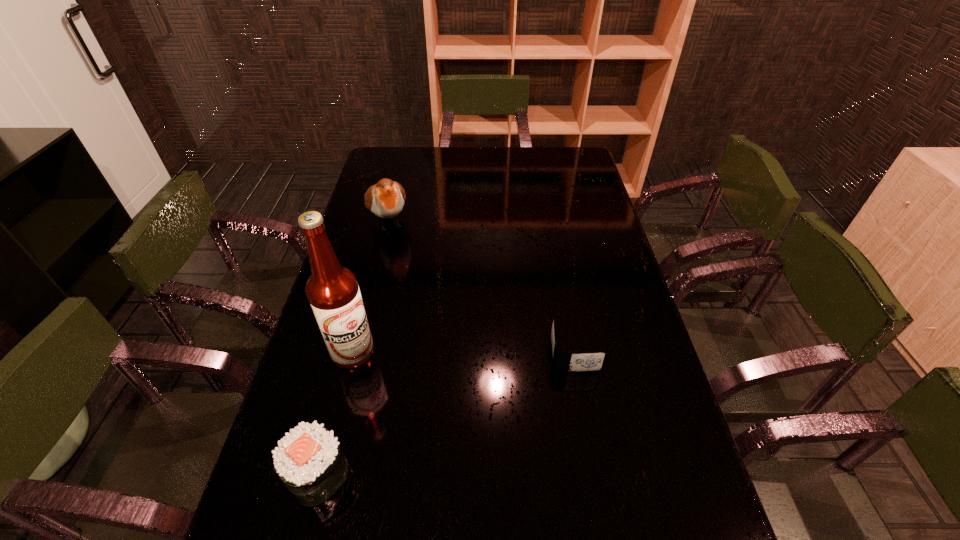
Find the location of a particular element. The width and height of the screenshot is (960, 540). free location located on the label side of the tallest object is located at coordinates (496, 420).

Locate an element on the screen. free space located 0.190m on the label side of the tallest object is located at coordinates (431, 389).

You are a GUI agent. You are given a task and a screenshot of the screen. Output one action in this format:
    pyautogui.click(x=<x>, y=<y>)
    Task: Click on the vacant space located 0.390m at the face of the second tallest object
    
    Given the screenshot: What is the action you would take?
    (427, 321)

Identify the location of vacant space located at the face of the second tallest object. (408, 276).

At what (x,y) coordinates should I click in order to perform the action: click on free space located at the face of the second tallest object. Please return your answer as a coordinate pair (x, y). Looking at the image, I should click on [x=398, y=255].

Where is `object at the near edge`? The image size is (960, 540). object at the near edge is located at coordinates (309, 460).

I want to click on sushi at the left edge, so click(x=309, y=460).

This screenshot has width=960, height=540. Find the location of `alcohol at the left edge`. alcohol at the left edge is located at coordinates (332, 290).

Where is `bird at the left edge`? The image size is (960, 540). bird at the left edge is located at coordinates (385, 199).

Where is `object that is at the right edge`? Image resolution: width=960 pixels, height=540 pixels. object that is at the right edge is located at coordinates (587, 360).